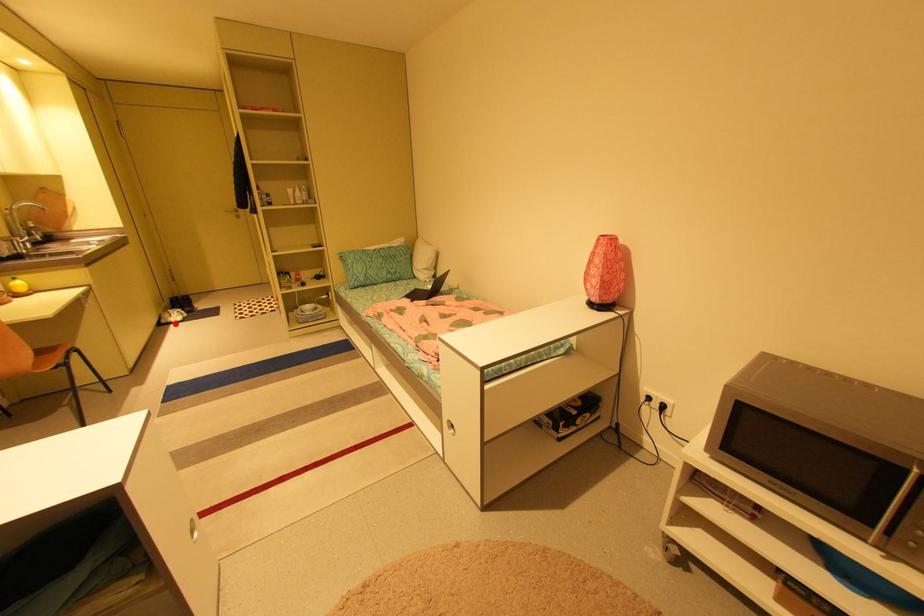
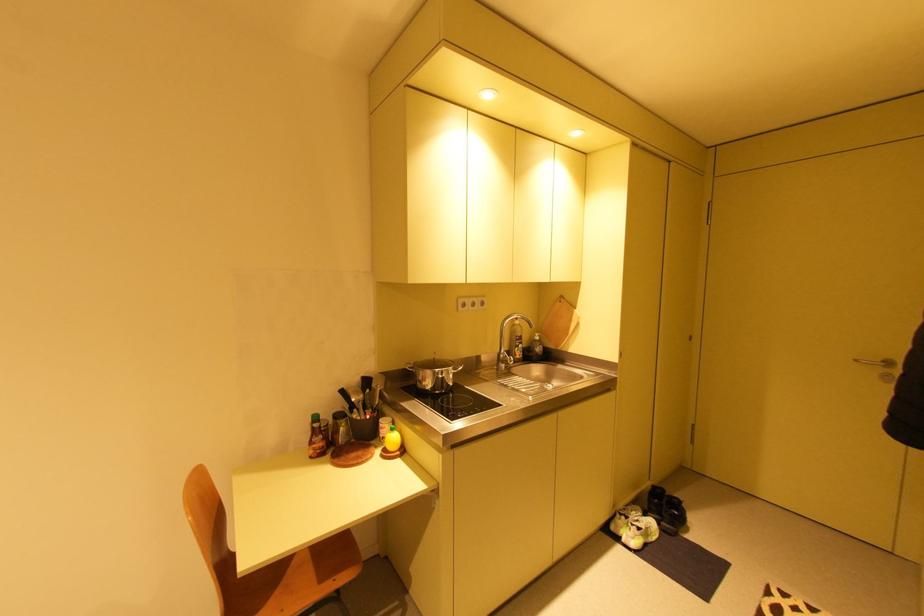
Find the pixel in the second image that matches the highlighted location in the first image.

(623, 538)